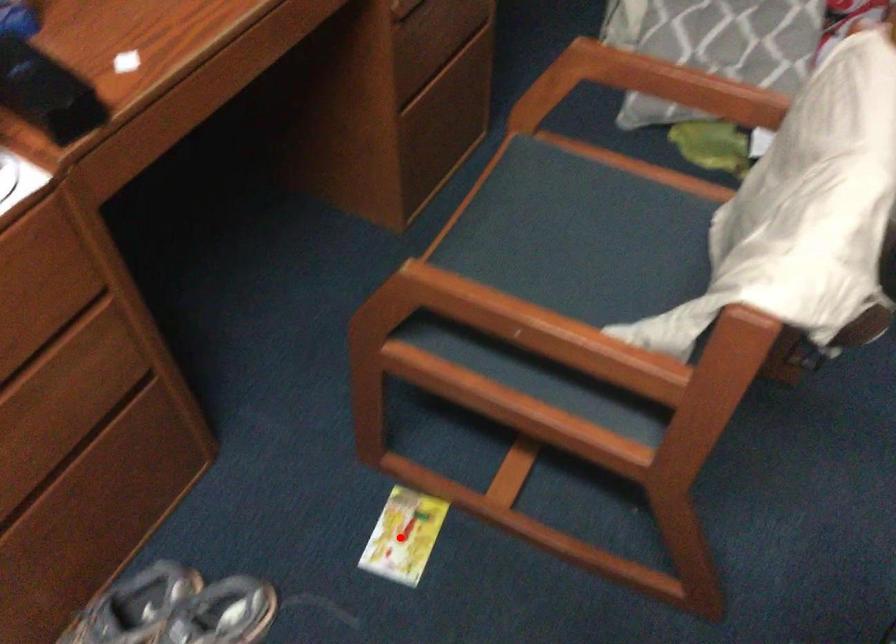
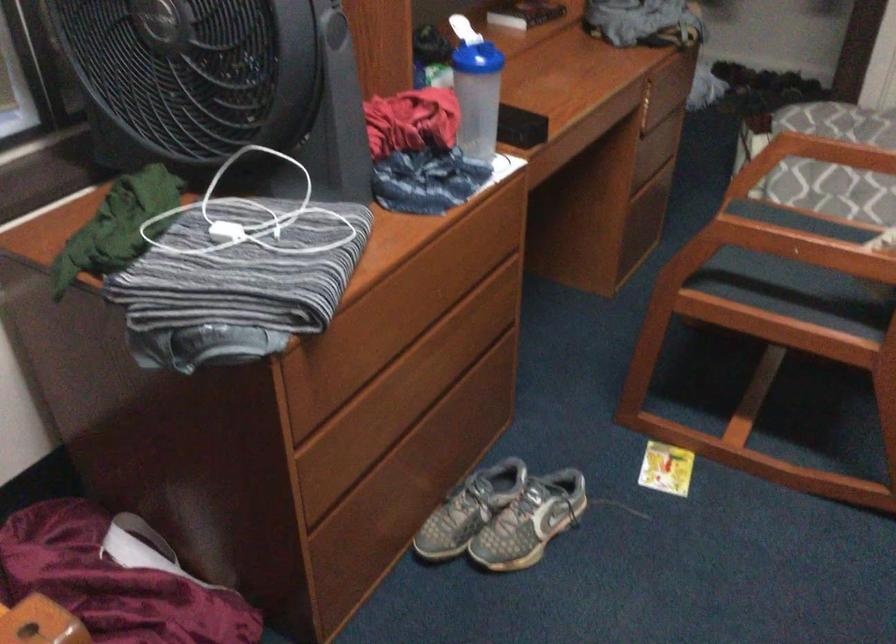
Find the pixel in the second image that matches the highlighted location in the first image.

(666, 468)